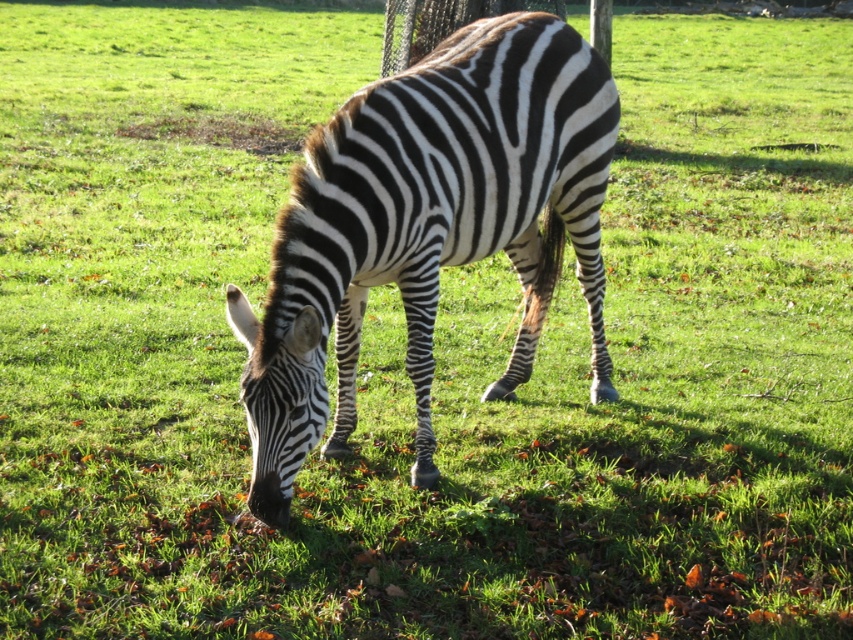
Between black and white striped zebra at center and black and white striped zebra head at lower center, which one is positioned lower?

black and white striped zebra head at lower center is lower down.

Between black and white striped zebra at center and black and white striped zebra head at lower center, which one appears on the right side from the viewer's perspective?

black and white striped zebra at center is more to the right.

Identify the location of black and white striped zebra at center. The width and height of the screenshot is (853, 640). (427, 227).

This screenshot has height=640, width=853. In order to click on black and white striped zebra at center in this screenshot , I will do `click(427, 227)`.